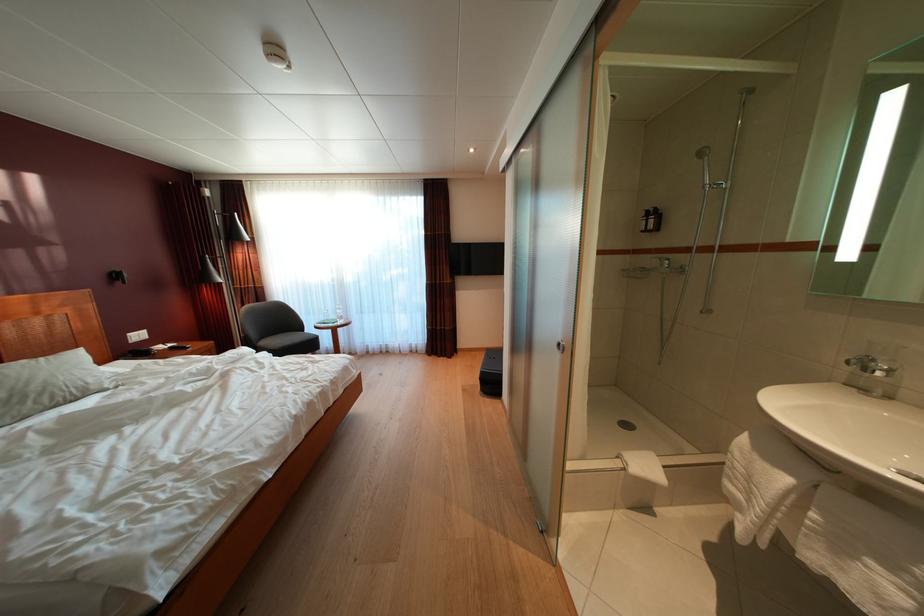
Describe the element at coordinates (338, 313) in the screenshot. I see `the clear water bottle` at that location.